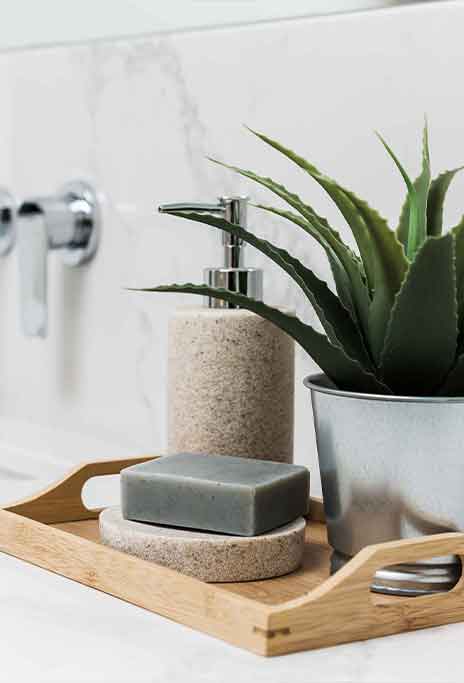
Identify the location of wooden tray. Image resolution: width=464 pixels, height=683 pixels. (255, 624).